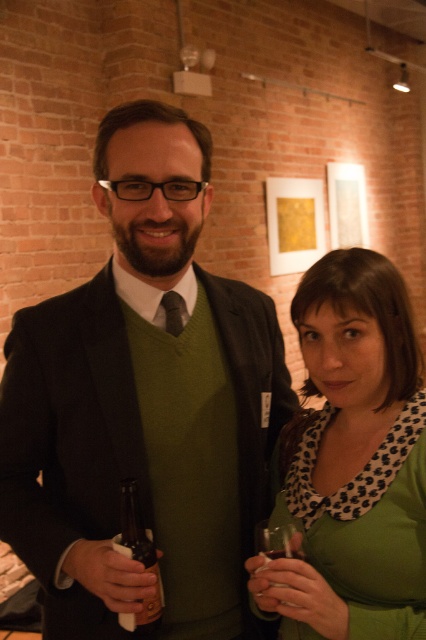
Question: Does matte green blouse at center appear over clear glass at right?

Choices:
 (A) no
 (B) yes

Answer: (B)

Question: Which point appears farthest from the camera in this image?

Choices:
 (A) (305, 456)
 (B) (195, 228)
 (C) (157, 592)
 (D) (268, 552)

Answer: (A)

Question: Which point is closer to the camera?

Choices:
 (A) click(288, 554)
 (B) click(403, 401)
 (C) click(161, 595)
 (D) click(249, 528)

Answer: (A)

Question: Which object is the farthest from the matte green blouse at center?

Choices:
 (A) clear glass at right
 (B) green matte sweater at center
 (C) translucent glass bottle at center

Answer: (C)

Question: Is green matte sweater at center to the left of translucent glass bottle at center from the viewer's perspective?

Choices:
 (A) yes
 (B) no

Answer: (B)

Question: Is matte green blouse at center above translucent glass bottle at center?

Choices:
 (A) no
 (B) yes

Answer: (B)